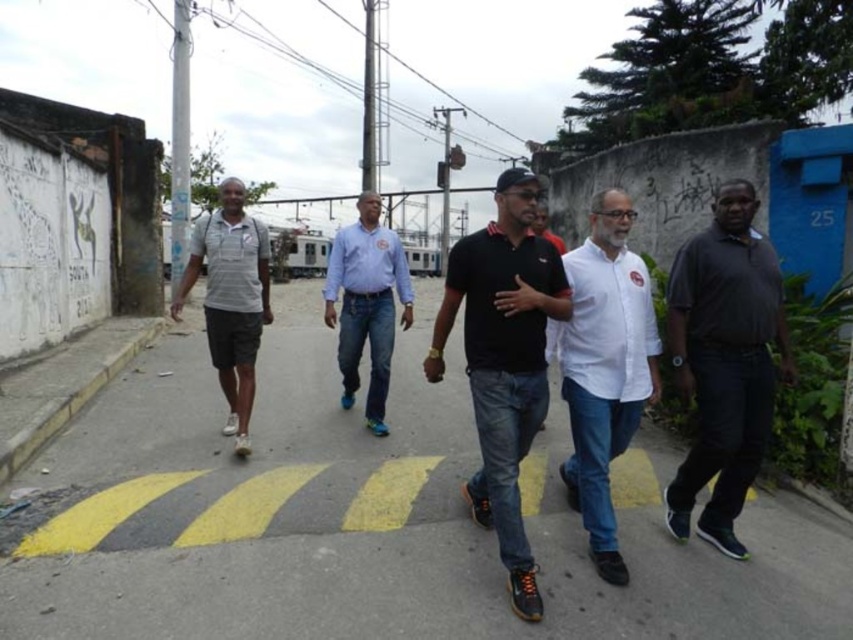
Question: Is white matte shirt at center positioned at the back of blue jeans at center?

Choices:
 (A) yes
 (B) no

Answer: (B)

Question: Does dark gray shirt at right come behind black matte polo shirt at center?

Choices:
 (A) yes
 (B) no

Answer: (A)

Question: Which point is closer to the camera?

Choices:
 (A) yellow asphalt at center
 (B) white matte shirt at center

Answer: (A)

Question: Which object is the closest to the yellow asphalt at center?

Choices:
 (A) blue jeans at center
 (B) white matte shirt at center

Answer: (A)

Question: Can you confirm if white matte shirt at center is positioned to the left of blue jeans at center?

Choices:
 (A) no
 (B) yes

Answer: (A)

Question: Which point is closer to the camera?

Choices:
 (A) (332, 550)
 (B) (386, 308)
 (C) (532, 392)
 (D) (676, 502)

Answer: (C)